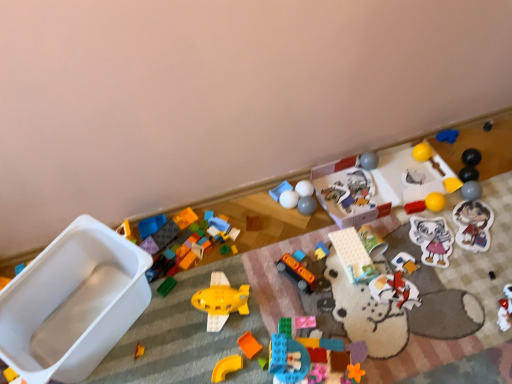
Image resolution: width=512 pixels, height=384 pixels. What are the coordinates of `empty space that is in between white glossy sticker at center-right, which is counted as the sixth toy, starting from the right, and matte gray ball at right, the 2th toy from the right` in the screenshot? It's located at (453, 221).